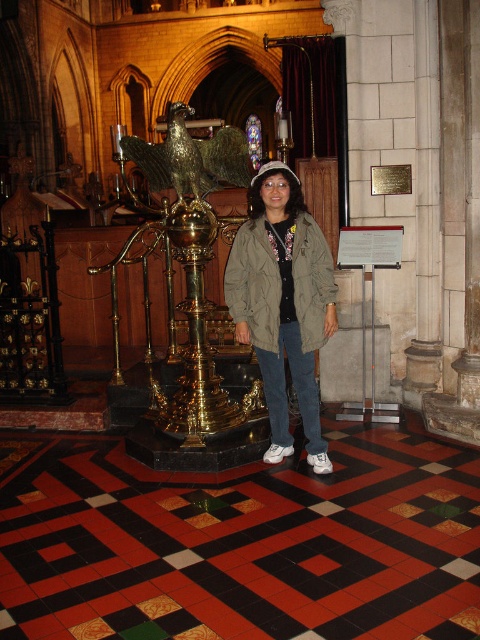
Which of these two, olive green fabric trench coat at center or gold polished eagle at center, stands shorter?

With less height is gold polished eagle at center.

Is olive green fabric trench coat at center further to camera compared to gold polished eagle at center?

That is False.

Is point (242, 236) farther from viewer compared to point (208, 172)?

That is False.

Locate an element on the screen. The height and width of the screenshot is (640, 480). olive green fabric trench coat at center is located at coordinates (279, 282).

Between khaki fabric jacket at center and olive green fabric trench coat at center, which one is positioned higher?

olive green fabric trench coat at center is above.

Can you confirm if khaki fabric jacket at center is smaller than olive green fabric trench coat at center?

No.

Where is `khaki fabric jacket at center`? This screenshot has width=480, height=640. khaki fabric jacket at center is located at coordinates (283, 304).

Consider the image. Who is shorter, khaki fabric jacket at center or gold polished eagle at center?

gold polished eagle at center

Measure the distance between point (265, 268) and camera.

A distance of 4.60 meters exists between point (265, 268) and camera.

The image size is (480, 640). What are the coordinates of `khaki fabric jacket at center` in the screenshot? It's located at [x=283, y=304].